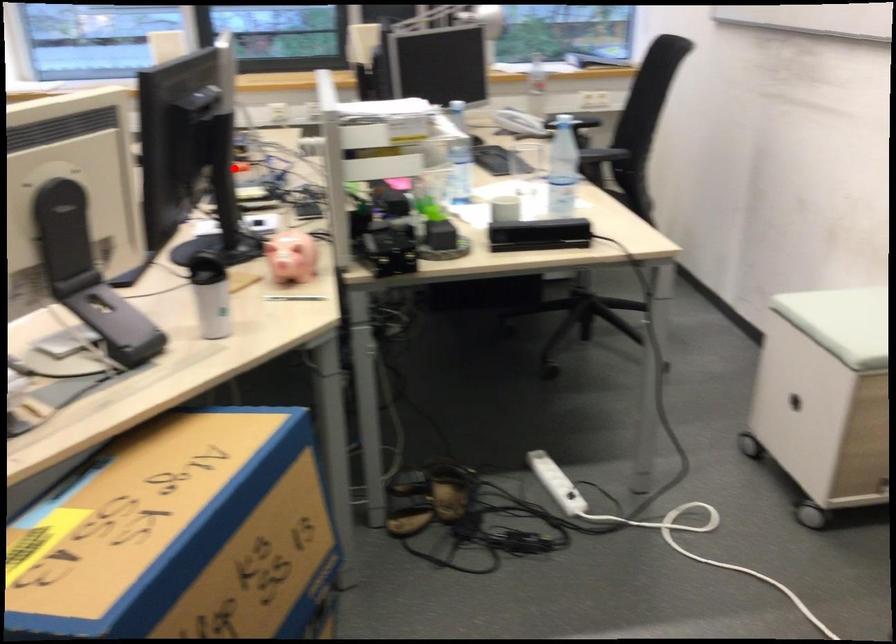
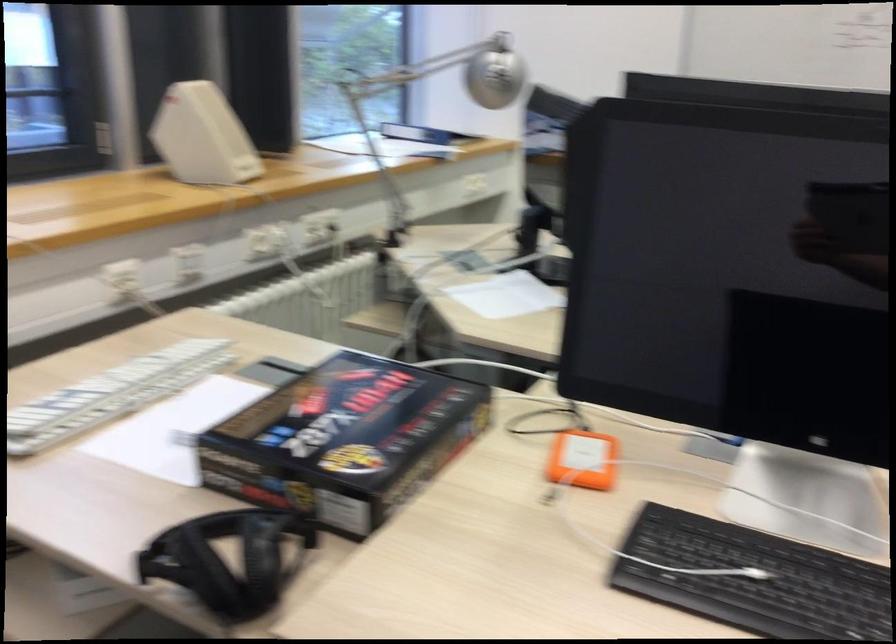
Question: I am providing you with two images of the same scene from different viewpoints. A red point is shown in image1. For the corresponding object point in image2, is it positioned nearer or farther from the camera?

Choices:
 (A) Nearer
 (B) Farther

Answer: (A)